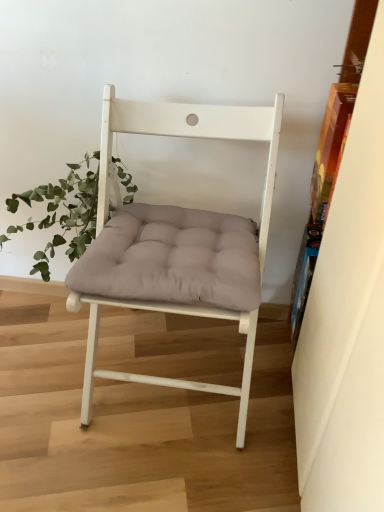
Where is `wooden bookshelf at right`? This screenshot has height=512, width=384. wooden bookshelf at right is located at coordinates (347, 322).

Image resolution: width=384 pixels, height=512 pixels. What do you see at coordinates (347, 322) in the screenshot?
I see `wooden bookshelf at right` at bounding box center [347, 322].

What is the approximate width of matte white chair at center?

20.20 inches.

The image size is (384, 512). Find the location of `wooden bookshelf at right`. wooden bookshelf at right is located at coordinates (347, 322).

Which object is positioned more to the left, wooden bookshelf at right or green leafy plant at left?

From the viewer's perspective, green leafy plant at left appears more on the left side.

What's the angular difference between wooden bookshelf at right and green leafy plant at left's facing directions?

wooden bookshelf at right and green leafy plant at left are facing 89.8 degrees away from each other.

Is wooden bookshelf at right completely or partially outside of green leafy plant at left?

That's correct, wooden bookshelf at right is outside of green leafy plant at left.

Is wooden bookshelf at right not near green leafy plant at left?

No, wooden bookshelf at right is in close proximity to green leafy plant at left.

Is matte white chair at center thinner than green leafy plant at left?

No.

Which of these two, matte white chair at center or green leafy plant at left, stands shorter?

Standing shorter between the two is green leafy plant at left.

From the image's perspective, does matte white chair at center appear higher than green leafy plant at left?

No, from the image's perspective, matte white chair at center is not above green leafy plant at left.

Who is shorter, green leafy plant at left or matte white chair at center?

green leafy plant at left.

Does green leafy plant at left turn towards matte white chair at center?

No, green leafy plant at left is not oriented towards matte white chair at center.

Which of these two, green leafy plant at left or matte white chair at center, is bigger?

matte white chair at center is bigger.

Does matte white chair at center have a greater height compared to wooden bookshelf at right?

No, matte white chair at center is not taller than wooden bookshelf at right.

Is matte white chair at center behind wooden bookshelf at right?

That is True.

Considering the sizes of objects matte white chair at center and wooden bookshelf at right in the image provided, who is thinner, matte white chair at center or wooden bookshelf at right?

Thinner between the two is wooden bookshelf at right.

Considering the positions of point (195, 116) and point (374, 508), is point (195, 116) closer or farther from the camera than point (374, 508)?

Point (195, 116) is farther from the camera than point (374, 508).

Is wooden bookshelf at right next to matte white chair at center and touching it?

No, wooden bookshelf at right is not beside matte white chair at center.

Which object is positioned more to the right, wooden bookshelf at right or matte white chair at center?

wooden bookshelf at right is more to the right.

Does wooden bookshelf at right turn towards matte white chair at center?

Yes, wooden bookshelf at right is oriented towards matte white chair at center.

In the image, is wooden bookshelf at right positioned in front of or behind matte white chair at center?

wooden bookshelf at right is in front of matte white chair at center.

Would you say green leafy plant at left contains wooden bookshelf at right?

That's incorrect, wooden bookshelf at right is not inside green leafy plant at left.

Is green leafy plant at left oriented away from wooden bookshelf at right?

No, green leafy plant at left's orientation is not away from wooden bookshelf at right.

From a real-world perspective, is green leafy plant at left positioned over wooden bookshelf at right based on gravity?

Incorrect, from a real-world perspective, green leafy plant at left is lower than wooden bookshelf at right.

From the picture: Considering the sizes of objects green leafy plant at left and wooden bookshelf at right in the image provided, who is bigger, green leafy plant at left or wooden bookshelf at right?

With larger size is wooden bookshelf at right.

In the image, there is a wooden bookshelf at right. Where is `houseplant below it (from a real-world perspective)`? houseplant below it (from a real-world perspective) is located at coordinates (61, 214).

Locate an element on the screen. This screenshot has width=384, height=512. chair below the green leafy plant at left (from the image's perspective) is located at coordinates (178, 234).

Considering their positions, is wooden bookshelf at right positioned closer to green leafy plant at left than matte white chair at center?

matte white chair at center is positioned closer to the anchor green leafy plant at left.

Based on their spatial positions, is matte white chair at center or wooden bookshelf at right further from green leafy plant at left?

wooden bookshelf at right is further to green leafy plant at left.

Looking at the image, which one is located closer to matte white chair at center, wooden bookshelf at right or green leafy plant at left?

green leafy plant at left is closer to matte white chair at center.

Which object lies further to the anchor point matte white chair at center, green leafy plant at left or wooden bookshelf at right?

wooden bookshelf at right is further to matte white chair at center.

Estimate the real-world distances between objects in this image. Which object is further from wooden bookshelf at right, green leafy plant at left or matte white chair at center?

green leafy plant at left is further to wooden bookshelf at right.

From the image, which object appears to be farther from wooden bookshelf at right, matte white chair at center or green leafy plant at left?

green leafy plant at left is further to wooden bookshelf at right.

The width and height of the screenshot is (384, 512). What are the coordinates of `chair between wooden bookshelf at right and green leafy plant at left from front to back` in the screenshot? It's located at (178, 234).